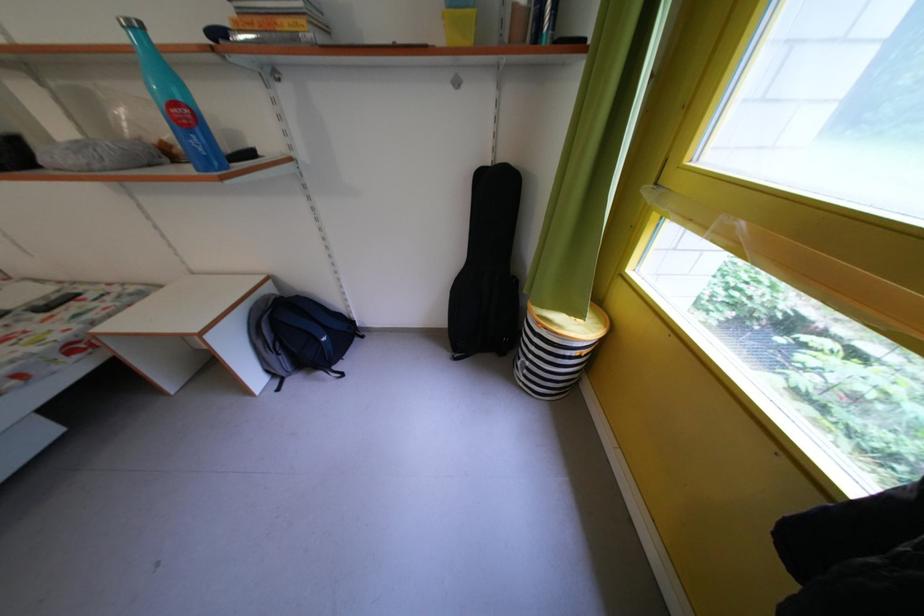
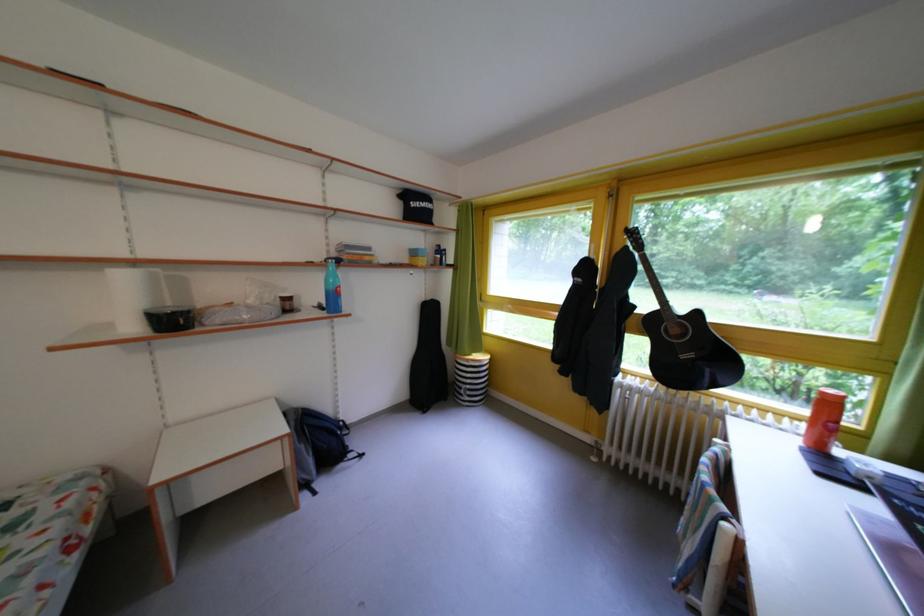
Find the pixel in the second image that matches (x=537, y=369) in the first image.

(478, 392)